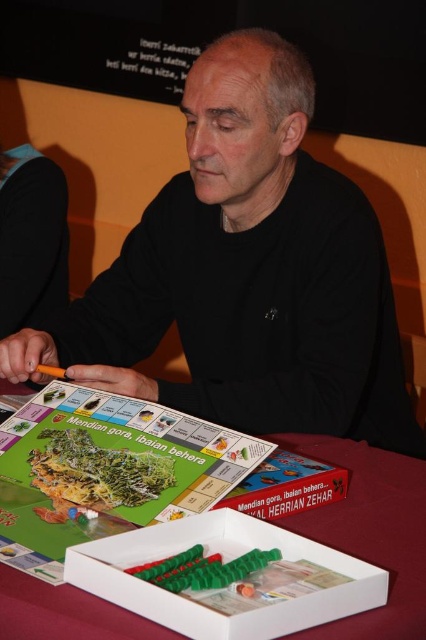
Question: From the image, what is the correct spatial relationship of black matte shirt at center in relation to red cloth at lower center?

Choices:
 (A) right
 (B) left

Answer: (B)

Question: Is the position of black matte shirt at center less distant than that of red cloth at lower center?

Choices:
 (A) yes
 (B) no

Answer: (B)

Question: Observing the image, what is the correct spatial positioning of black matte shirt at center in reference to red cloth at lower center?

Choices:
 (A) above
 (B) below

Answer: (A)

Question: Which point is farther to the camera?

Choices:
 (A) red cloth at lower center
 (B) black matte shirt at center

Answer: (B)